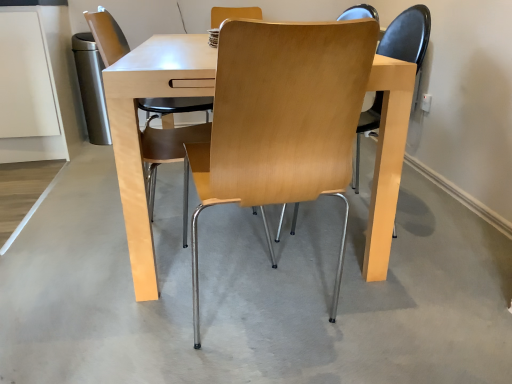
Question: Should I look upward or downward to see light wood/matte chair at center, the 2th chair viewed from the right?

Choices:
 (A) down
 (B) up

Answer: (B)

Question: Is light wood/matte chair at center, the 1th chair from the left, located within light wood/chrome chair at center, the 1th chair when ordered from right to left?

Choices:
 (A) yes
 (B) no

Answer: (B)

Question: From a real-world perspective, is light wood/chrome chair at center, positioned as the 2th chair in left-to-right order, located beneath light wood/matte chair at center, the 2th chair viewed from the right?

Choices:
 (A) yes
 (B) no

Answer: (A)

Question: Is light wood/chrome chair at center, positioned as the 2th chair in left-to-right order, taller than light wood/matte chair at center, the 1th chair from the left?

Choices:
 (A) yes
 (B) no

Answer: (B)

Question: From a real-world perspective, is light wood/chrome chair at center, the 1th chair when ordered from right to left, over light wood/matte chair at center, the 2th chair viewed from the right?

Choices:
 (A) yes
 (B) no

Answer: (B)

Question: From the image's perspective, would you say light wood/chrome chair at center, positioned as the 2th chair in left-to-right order, is shown under light wood/matte chair at center, the 2th chair viewed from the right?

Choices:
 (A) yes
 (B) no

Answer: (A)

Question: Considering the relative sizes of light wood/chrome chair at center, positioned as the 2th chair in left-to-right order, and light wood/matte chair at center, the 1th chair from the left, in the image provided, is light wood/chrome chair at center, positioned as the 2th chair in left-to-right order, smaller than light wood/matte chair at center, the 1th chair from the left,?

Choices:
 (A) no
 (B) yes

Answer: (A)

Question: Does light gray concrete at center have a lesser width compared to light wood/chrome chair at center, positioned as the 2th chair in left-to-right order?

Choices:
 (A) no
 (B) yes

Answer: (A)

Question: From the image's perspective, would you say light gray concrete at center is positioned over light wood/chrome chair at center, the 1th chair when ordered from right to left?

Choices:
 (A) no
 (B) yes

Answer: (A)

Question: Is light gray concrete at center shorter than light wood/chrome chair at center, the 1th chair when ordered from right to left?

Choices:
 (A) yes
 (B) no

Answer: (A)

Question: Is light gray concrete at center wider than light wood/chrome chair at center, positioned as the 2th chair in left-to-right order?

Choices:
 (A) no
 (B) yes

Answer: (B)

Question: Is the surface of light gray concrete at center in direct contact with light wood/chrome chair at center, positioned as the 2th chair in left-to-right order?

Choices:
 (A) yes
 (B) no

Answer: (B)

Question: Does light gray concrete at center have a greater height compared to light wood/chrome chair at center, positioned as the 2th chair in left-to-right order?

Choices:
 (A) no
 (B) yes

Answer: (A)

Question: Could you tell me if light wood/matte chair at center, the 2th chair viewed from the right, is turned towards light gray concrete at center?

Choices:
 (A) yes
 (B) no

Answer: (B)